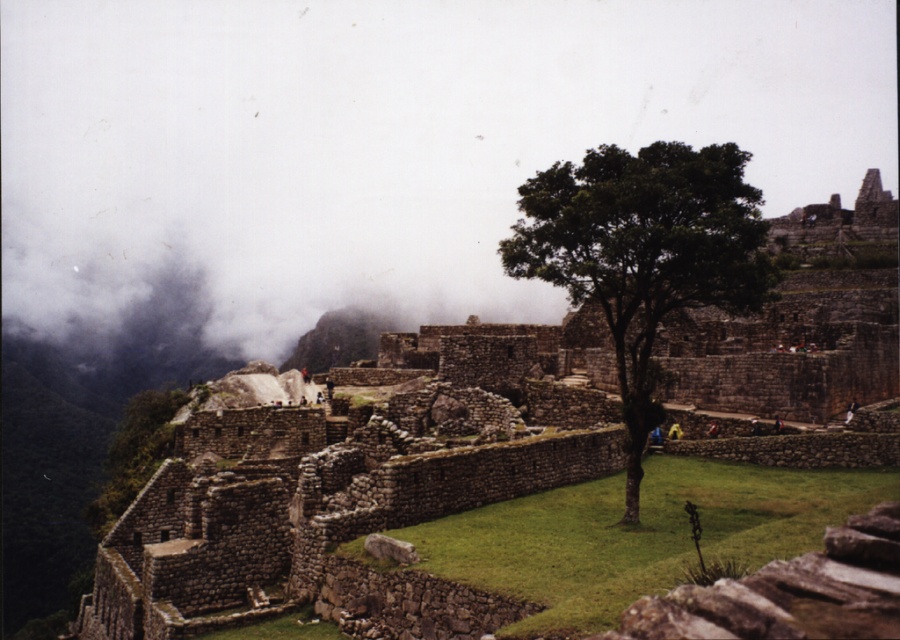
Question: Which point is closer to the camera taking this photo?

Choices:
 (A) (747, 257)
 (B) (230, 429)

Answer: (A)

Question: Is gray fog at upper left smaller than green leafy tree at center?

Choices:
 (A) yes
 (B) no

Answer: (B)

Question: Which point is closer to the camera?

Choices:
 (A) (601, 278)
 (B) (797, 419)
 (C) (23, 88)

Answer: (A)

Question: Which point is closer to the camera?

Choices:
 (A) green leafy tree at center
 (B) gray fog at upper left

Answer: (A)

Question: Does gray fog at upper left come in front of brown stone ruins at center?

Choices:
 (A) no
 (B) yes

Answer: (A)

Question: Is gray fog at upper left below brown stone ruins at center?

Choices:
 (A) yes
 (B) no

Answer: (B)